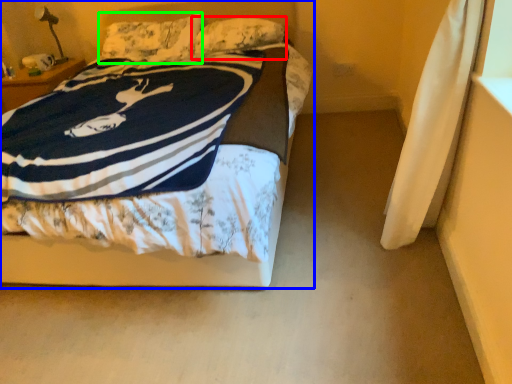
Question: Which is nearer to the pillow (highlighted by a red box)? bed (highlighted by a blue box) or pillow (highlighted by a green box).

Choices:
 (A) bed
 (B) pillow

Answer: (B)